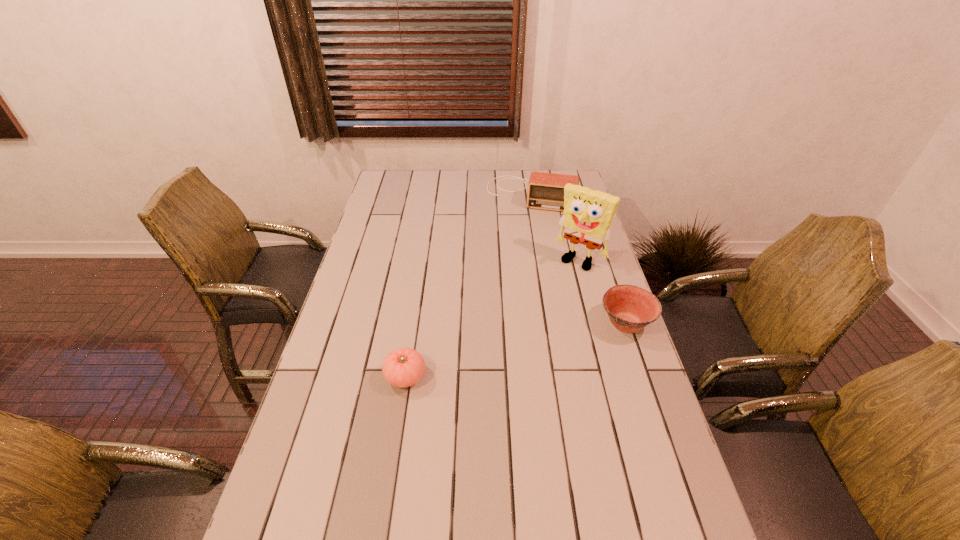
Where is `vacant space at the far edge of the desktop`? Image resolution: width=960 pixels, height=540 pixels. vacant space at the far edge of the desktop is located at coordinates (444, 186).

Identify the location of vacant space at the near edge of the desktop. (434, 528).

Locate an element on the screen. vacant area at the left edge is located at coordinates (273, 498).

In the image, there is a desktop. At what (x,y) coordinates should I click in order to perform the action: click on free space at the right edge. Please return your answer as a coordinate pair (x, y). Looking at the image, I should click on (608, 326).

Where is `vacant region at the near left corner`? The image size is (960, 540). vacant region at the near left corner is located at coordinates (319, 534).

This screenshot has height=540, width=960. In the image, there is a desktop. Find the location of `vacant area at the far right corner`. vacant area at the far right corner is located at coordinates (551, 171).

The height and width of the screenshot is (540, 960). What are the coordinates of `vacant space that's between the bowl and the sponge` in the screenshot? It's located at (603, 292).

The width and height of the screenshot is (960, 540). In order to click on unoccupied position between the third nearest object and the tomato in this screenshot , I will do `click(492, 319)`.

You are a GUI agent. You are given a task and a screenshot of the screen. Output one action in this format:
    pyautogui.click(x=<x>, y=<y>)
    Task: Click on the free space that is in between the farthest object and the second nearest object
    This screenshot has height=540, width=960.
    Given the screenshot: What is the action you would take?
    pyautogui.click(x=578, y=259)

Identify the location of free space between the second nearest object and the farthest object. The width and height of the screenshot is (960, 540). (578, 259).